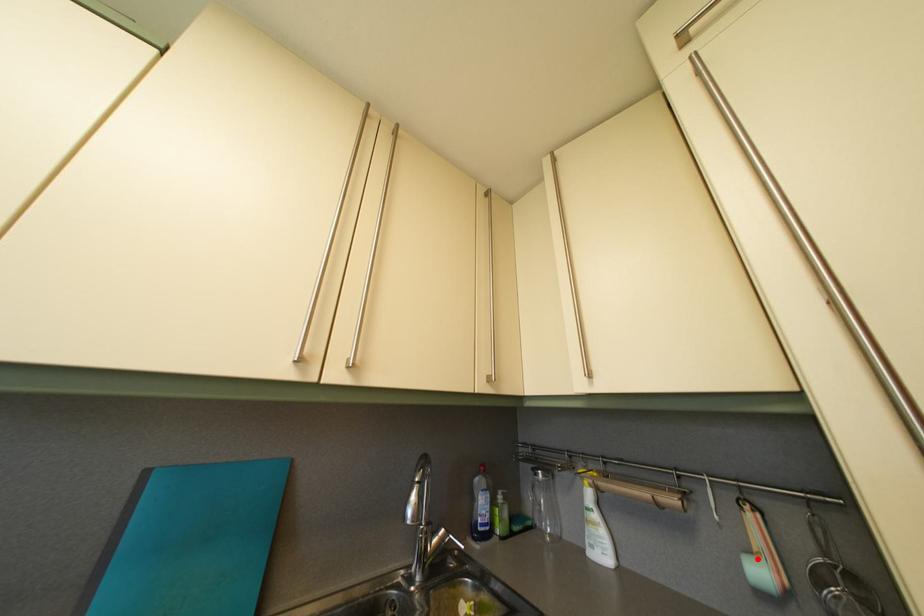
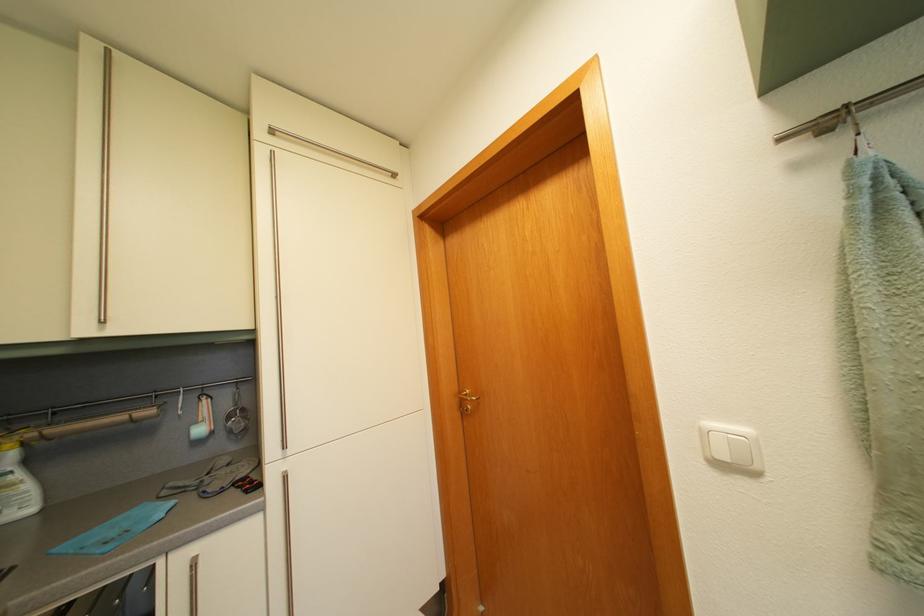
In the second image, find the point that corresponds to the highlighted location in the first image.

(204, 430)